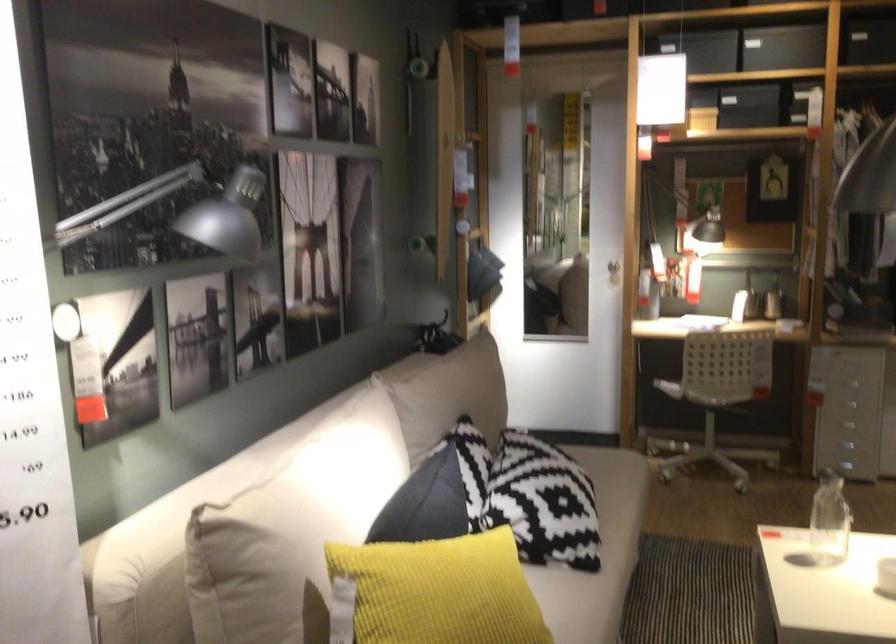
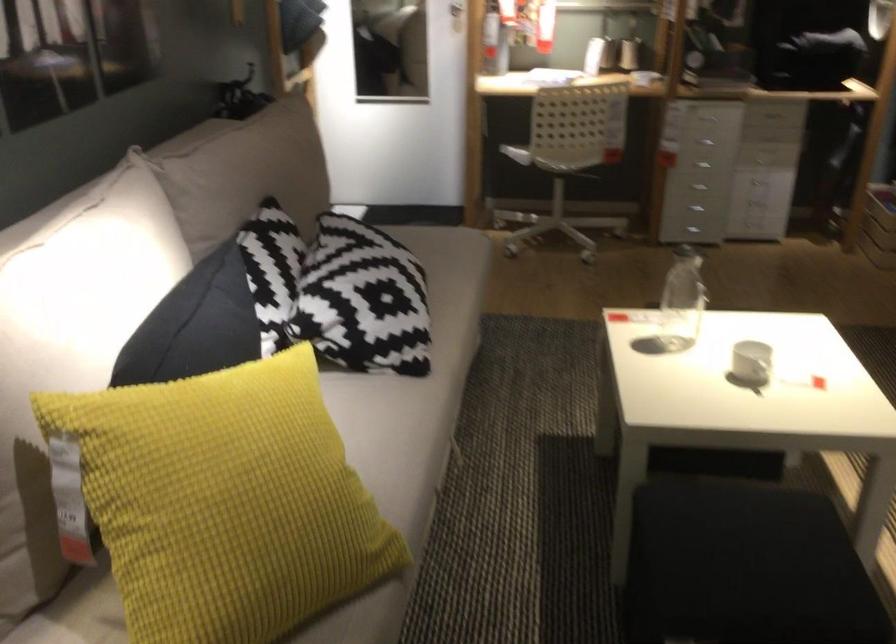
Question: What movement of the cameraman would produce the second image?

Choices:
 (A) Left
 (B) Right
 (C) Forward
 (D) Backward

Answer: (C)